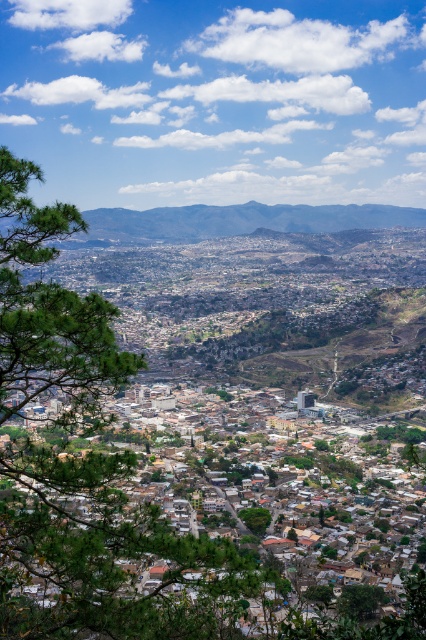
You are standing at the viewpoint looking at the green leafy tree at left and the green leafy tree at center. Which tree is closer to the left edge of the image?

The green leafy tree at left is closer to the left edge of the image because it is positioned on the left side of the green leafy tree at center.

You are standing at the viewpoint and want to take a photo of the city. You notice two green leafy trees in the foreground. Which tree, the green leafy tree at lower right or the green leafy tree at center, is closer to you?

The green leafy tree at lower right is closer to you because it is in front of the green leafy tree at center.

You are standing at the viewpoint looking at the green leafy tree at left and the green leafy tree at lower right. Which tree appears closer to you?

The green leafy tree at left appears closer because it is positioned over the green leafy tree at lower right, indicating it is in front of it.